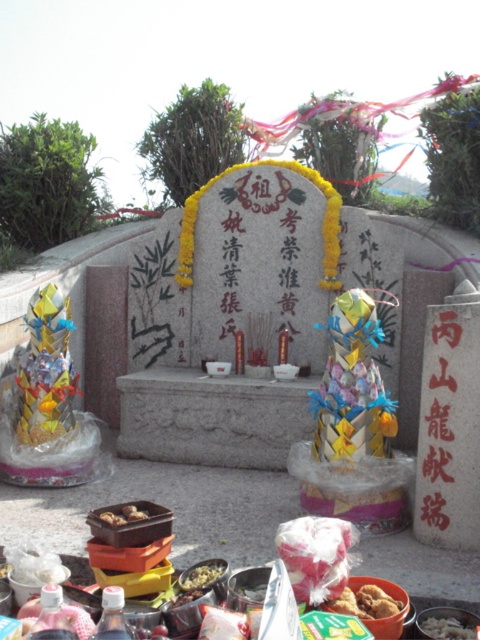
You are preparing to place an additional offering on the ground in front of the monument. The shiny metallic bowl at lower center and the shiny plastic container at center are already there. Which object should you place the new offering next to if you want to maximize the available space?

You should place the new offering next to the shiny plastic container at center because it occupies more space than the shiny metallic bowl at lower center, leaving more room for the new offering.

You are standing at the point marked as point [47,406] in the image. You want to take a photo of the grave monument with your camera. The camera is 4.12 meters away from your current position. Is the camera close enough to capture the entire monument in the photo?

The camera is 4.12 meters away from point [47,406], so yes, the camera is close enough to capture the entire monument in the photo since the distance is within a reasonable range for a typical camera lens.